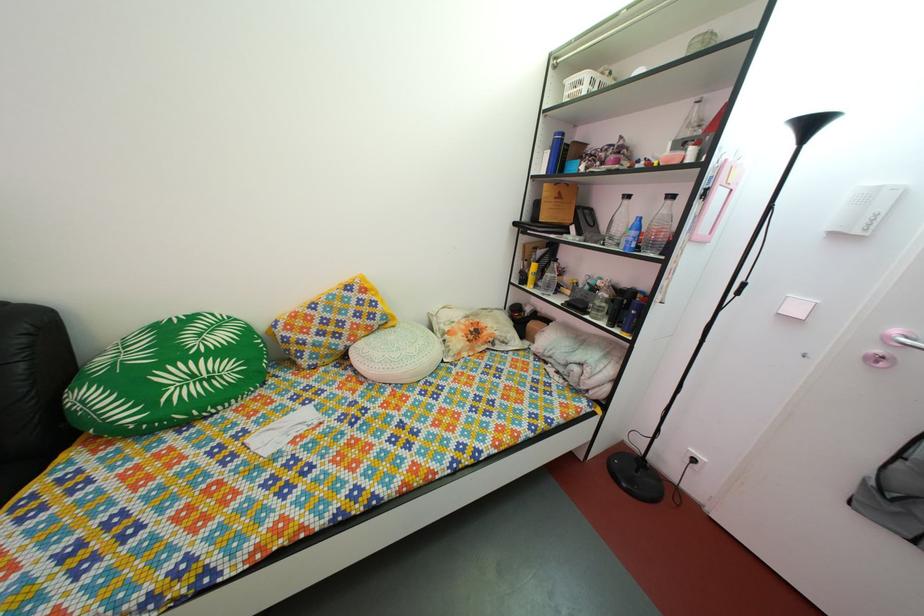
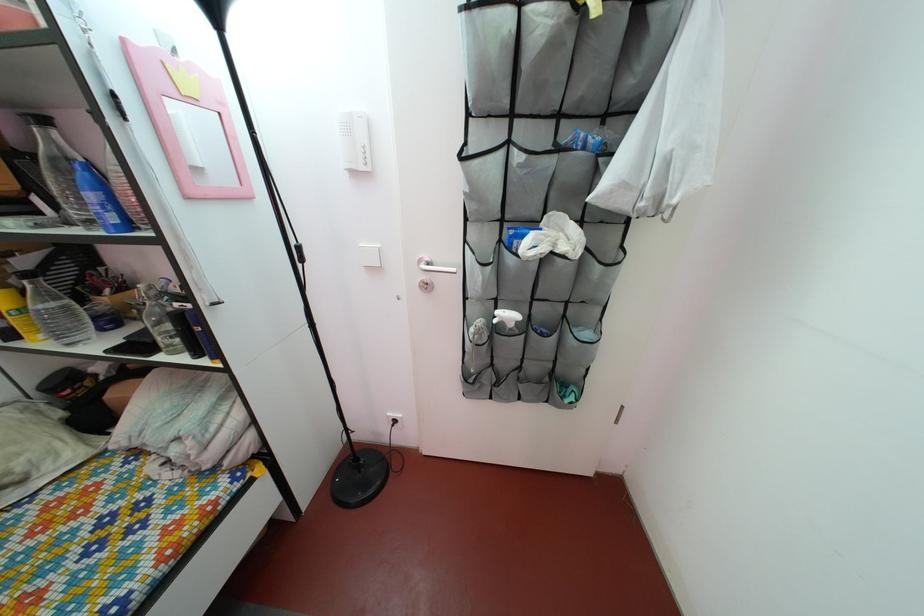
The point at (641, 254) is marked in the first image. Where is the corresponding point in the second image?

(124, 229)